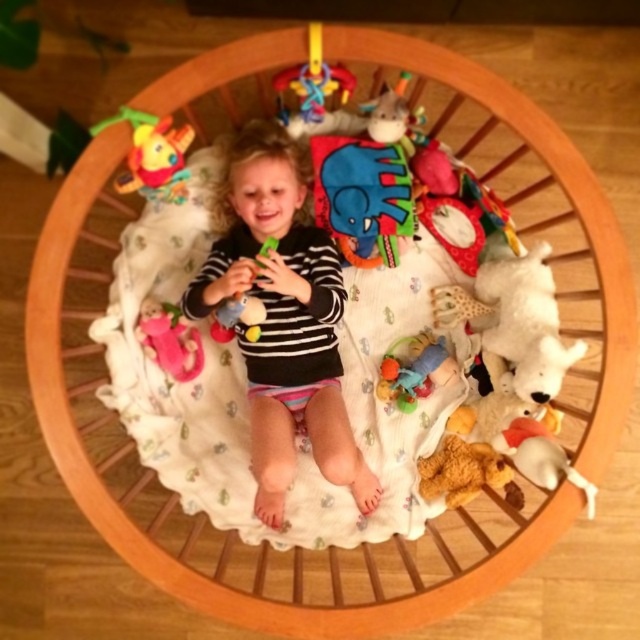
Question: Which object is closer to the camera taking this photo?

Choices:
 (A) pink fabric doll at lower left
 (B) soft plush bear at center
 (C) plush yellow duck at upper left

Answer: (C)

Question: Can you confirm if black striped shirt at center is positioned above white plush toy at lower right?

Choices:
 (A) yes
 (B) no

Answer: (A)

Question: Does soft plush bear at center have a lesser width compared to plush yellow duck at upper left?

Choices:
 (A) no
 (B) yes

Answer: (A)

Question: Which point appears closest to the camera in this image?

Choices:
 (A) (579, 484)
 (B) (410, 410)

Answer: (A)

Question: Observing the image, what is the correct spatial positioning of plush yellow duck at upper left in reference to soft plush toy at center?

Choices:
 (A) above
 (B) below

Answer: (A)

Question: Which object appears closest to the camera in this image?

Choices:
 (A) black striped shirt at center
 (B) blue felt elephant at center

Answer: (A)